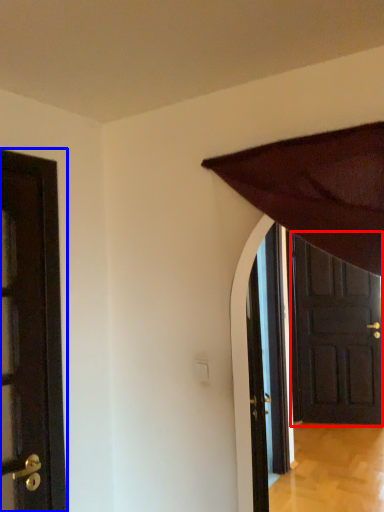
Question: Which point is further to the camera, door (highlighted by a red box) or door (highlighted by a blue box)?

Choices:
 (A) door
 (B) door

Answer: (A)